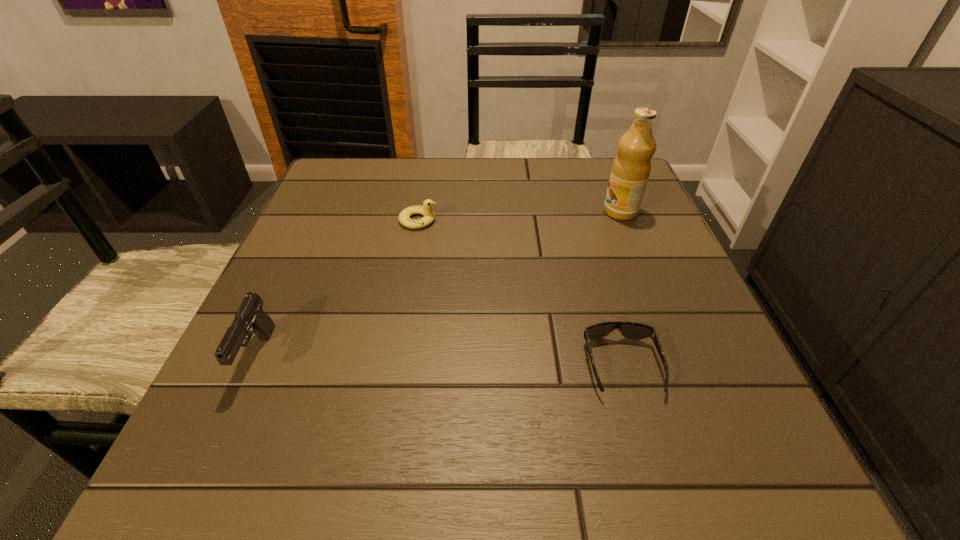
You are a GUI agent. You are given a task and a screenshot of the screen. Output one action in this format:
    pyautogui.click(x=<x>, y=<y>)
    Task: Click on the vacant area in the image that satisfies the following two spatial constraints: 1. on the face of the third tallest object; 2. aim along the barrel of the third shortest object
    
    Given the screenshot: What is the action you would take?
    pyautogui.click(x=396, y=356)